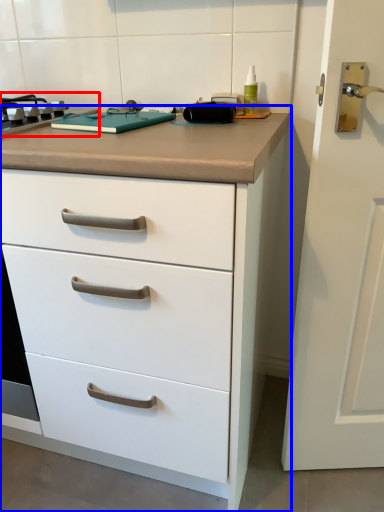
Question: Which object is further to the camera taking this photo, gas stove (highlighted by a red box) or chest of drawers (highlighted by a blue box)?

Choices:
 (A) gas stove
 (B) chest of drawers

Answer: (A)